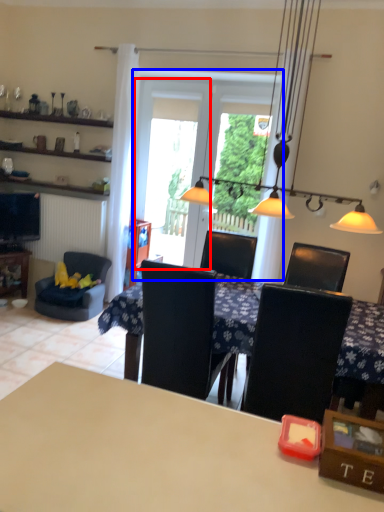
Question: Among these objects, which one is farthest to the camera, screen door (highlighted by a red box) or screen door (highlighted by a blue box)?

Choices:
 (A) screen door
 (B) screen door

Answer: (A)